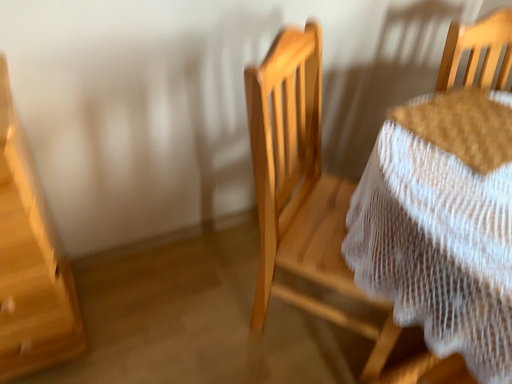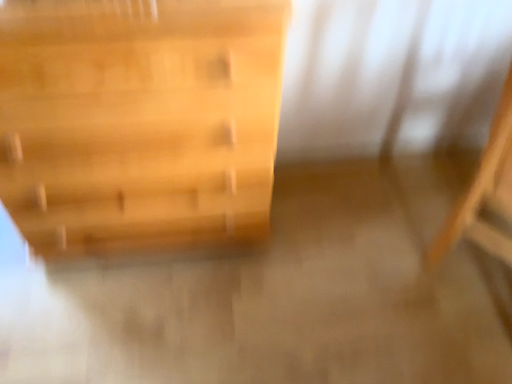
Question: Which way did the camera rotate in the video?

Choices:
 (A) rotated upward
 (B) rotated downward

Answer: (B)